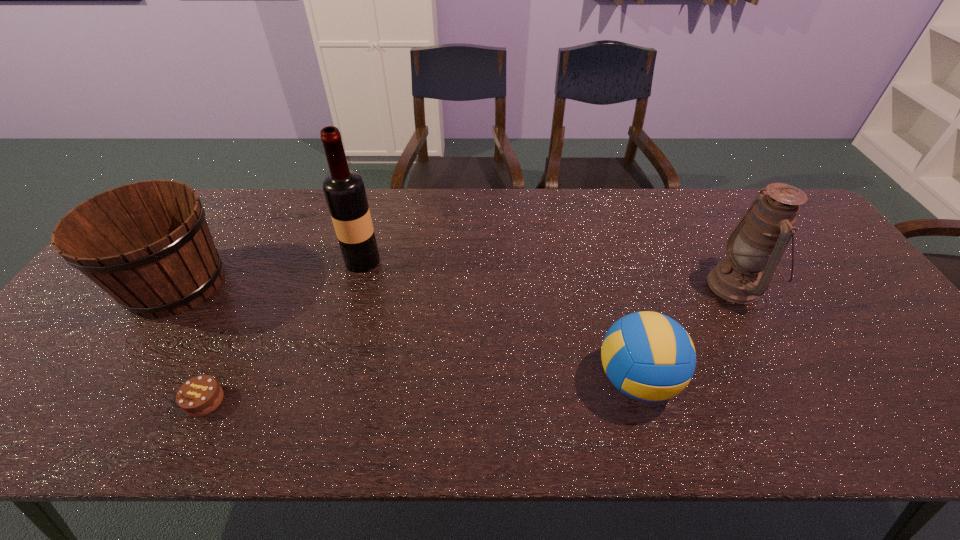
I want to click on vacant region located on the right of the third object from left to right, so click(x=484, y=261).

Where is `vacant space located 0.170m on the left of the rightmost object`? This screenshot has height=540, width=960. vacant space located 0.170m on the left of the rightmost object is located at coordinates (646, 285).

You are a GUI agent. You are given a task and a screenshot of the screen. Output one action in this format:
    pyautogui.click(x=<x>, y=<y>)
    Task: Click on the free point located 0.260m on the right of the wine bucket
    
    Given the screenshot: What is the action you would take?
    pyautogui.click(x=326, y=284)

Find the location of `vacant space situated on the left of the second shortest object`. vacant space situated on the left of the second shortest object is located at coordinates (498, 380).

Locate an element on the screen. Image resolution: width=960 pixels, height=540 pixels. vacant space located on the back of the shortest object is located at coordinates (238, 331).

In order to click on volleyball that is at the near edge in this screenshot , I will do `click(648, 356)`.

Identify the location of chocolate cake situated at the near edge. The width and height of the screenshot is (960, 540). (201, 395).

Where is `object present at the left edge`? object present at the left edge is located at coordinates (148, 245).

At what (x,y) coordinates should I click in order to perform the action: click on free space at the far edge. Please return your answer as a coordinate pair (x, y). The image size is (960, 540). Looking at the image, I should click on (434, 220).

In the image, there is a desktop. Identify the location of free space at the near edge. The width and height of the screenshot is (960, 540). (132, 431).